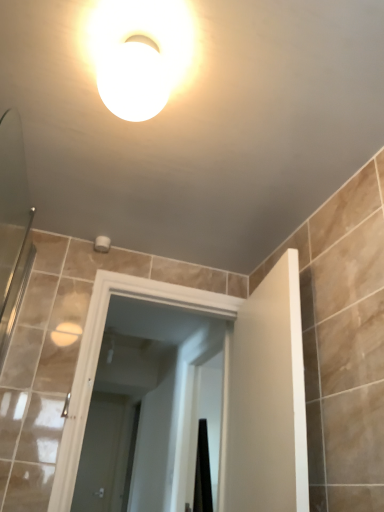
Question: Does white glossy door at center, the first screen door when ordered from back to front, have a larger size compared to white glossy door at center, marked as the first screen door in a top-to-bottom arrangement?

Choices:
 (A) yes
 (B) no

Answer: (B)

Question: Could you tell me if white glossy door at center, the second screen door viewed from the top, is turned towards white glossy door at center, acting as the second screen door starting from the back?

Choices:
 (A) yes
 (B) no

Answer: (A)

Question: Is white glossy door at center, the second screen door positioned from the right, shorter than white glossy door at center, marked as the 2th screen door in a left-to-right arrangement?

Choices:
 (A) no
 (B) yes

Answer: (A)

Question: Is white glossy door at center, the second screen door viewed from the top, directly adjacent to white glossy door at center, the 1th screen door when ordered from front to back?

Choices:
 (A) yes
 (B) no

Answer: (B)

Question: From a real-world perspective, is white glossy door at center, the second screen door positioned from the right, under white glossy door at center, the 1th screen door from the right?

Choices:
 (A) no
 (B) yes

Answer: (B)

Question: Is white glossy door at center, the 1th screen door from the right, spatially inside white glossy door at center, acting as the 1th screen door starting from the bottom, or outside of it?

Choices:
 (A) inside
 (B) outside

Answer: (B)

Question: Is white glossy door at center, marked as the first screen door in a top-to-bottom arrangement, wider or thinner than white glossy door at center, the second screen door positioned from the right?

Choices:
 (A) wide
 (B) thin

Answer: (A)

Question: Would you say white glossy door at center, the 1th screen door when ordered from front to back, is to the left or to the right of white glossy door at center, which is the first screen door in left-to-right order, in the picture?

Choices:
 (A) left
 (B) right

Answer: (B)

Question: Is white glossy door at center, acting as the second screen door starting from the back, in front of or behind white glossy door at center, which is the first screen door in left-to-right order, in the image?

Choices:
 (A) behind
 (B) front

Answer: (B)

Question: Considering their positions, is white glossy light fixture at upper center located in front of or behind white glossy door at center, the second screen door viewed from the top?

Choices:
 (A) front
 (B) behind

Answer: (A)

Question: Looking at their shapes, would you say white glossy light fixture at upper center is wider or thinner than white glossy door at center, which is counted as the 2th screen door, starting from the front?

Choices:
 (A) wide
 (B) thin

Answer: (A)

Question: Based on their positions, is white glossy light fixture at upper center located to the left or right of white glossy door at center, the first screen door when ordered from back to front?

Choices:
 (A) left
 (B) right

Answer: (B)

Question: From the image's perspective, is white glossy light fixture at upper center located above or below white glossy door at center, which is the first screen door in left-to-right order?

Choices:
 (A) above
 (B) below

Answer: (A)

Question: Is white glossy light fixture at upper center inside or outside of white glossy door at center, the 1th screen door from the right?

Choices:
 (A) inside
 (B) outside

Answer: (B)

Question: Visually, is white glossy light fixture at upper center positioned to the left or to the right of white glossy door at center, the 1th screen door from the right?

Choices:
 (A) left
 (B) right

Answer: (A)